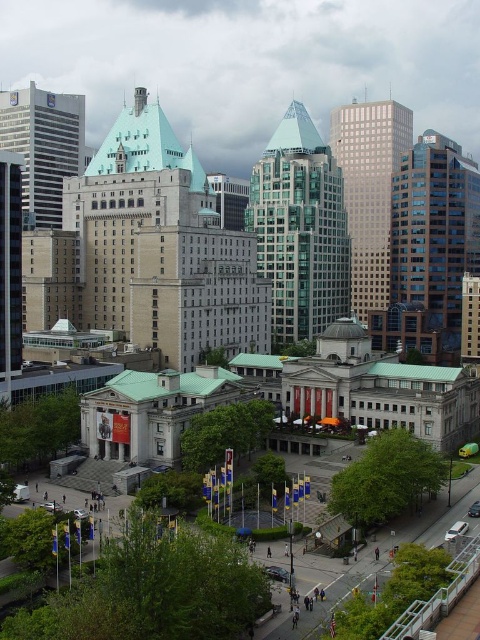
Can you confirm if teal glass tower at center is thinner than matte glass skyscraper at left?

No.

In the scene shown: Can you confirm if teal glass tower at center is smaller than matte glass skyscraper at left?

Incorrect, teal glass tower at center is not smaller in size than matte glass skyscraper at left.

Find the location of a particular element. teal glass tower at center is located at coordinates (300, 228).

Is matte silver skyscraper at left smaller than matte glass skyscraper at left?

Actually, matte silver skyscraper at left might be larger than matte glass skyscraper at left.

Does matte silver skyscraper at left have a greater width compared to matte glass skyscraper at left?

Yes, matte silver skyscraper at left is wider than matte glass skyscraper at left.

Does point (55, 208) come in front of point (12, 234)?

No, (55, 208) is further to viewer.

The height and width of the screenshot is (640, 480). I want to click on matte silver skyscraper at left, so click(x=43, y=147).

Between point (375, 193) and point (44, 147), which one is positioned in front?

Point (44, 147) is more forward.

Who is taller, glassy reflective skyscraper at center or matte silver skyscraper at left?

With more height is glassy reflective skyscraper at center.

What do you see at coordinates (369, 189) in the screenshot? This screenshot has height=640, width=480. I see `glassy reflective skyscraper at center` at bounding box center [369, 189].

Where is `glassy reflective skyscraper at center`? The image size is (480, 640). glassy reflective skyscraper at center is located at coordinates (369, 189).